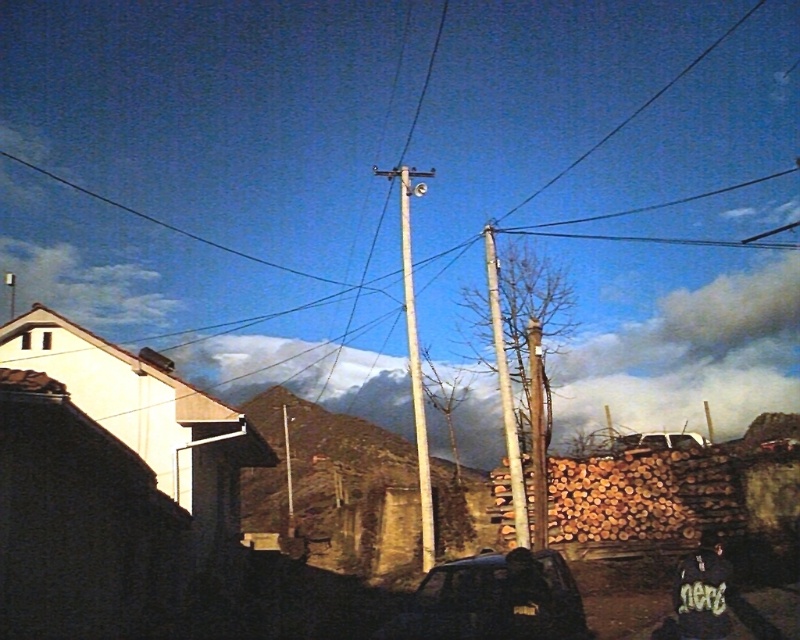
Question: Among these points, which one is farthest from the camera?

Choices:
 (A) (498, 593)
 (B) (644, 436)
 (C) (488, 300)
 (D) (413, 324)

Answer: (C)

Question: Which of the following is the closest to the observer?

Choices:
 (A) (716, 600)
 (B) (644, 433)
 (C) (492, 266)

Answer: (A)

Question: Does dark matte car at center have a smaller size compared to dark fabric shirt at lower right?

Choices:
 (A) no
 (B) yes

Answer: (B)

Question: Is dark fabric shirt at lower right wider than smooth wood telegraph pole at center?

Choices:
 (A) no
 (B) yes

Answer: (A)

Question: Where is dark fabric shirt at lower right located in relation to smooth wood telegraph pole at center in the image?

Choices:
 (A) below
 (B) above

Answer: (A)

Question: Which point is farther from the camera taking this photo?

Choices:
 (A) (501, 564)
 (B) (420, 376)
 (C) (617, 444)

Answer: (C)